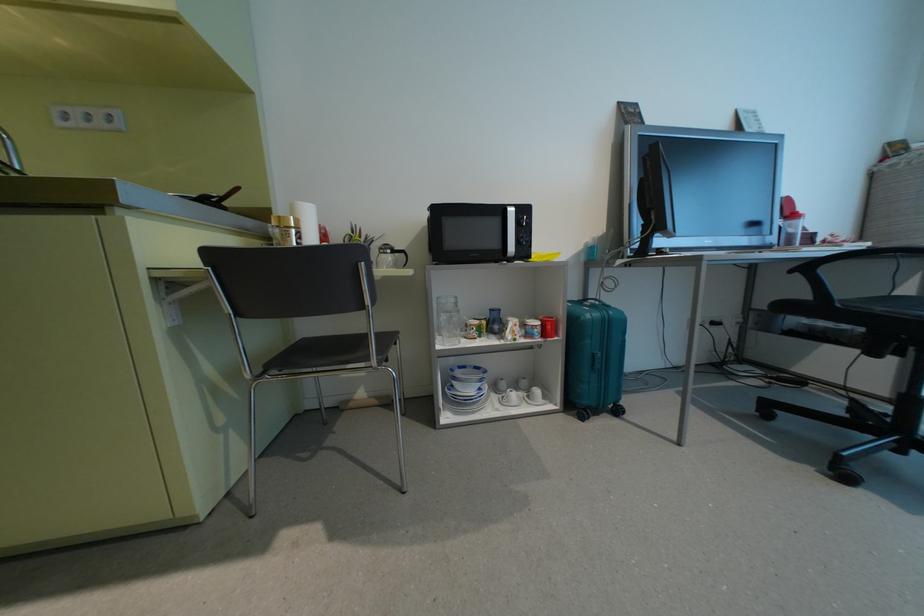
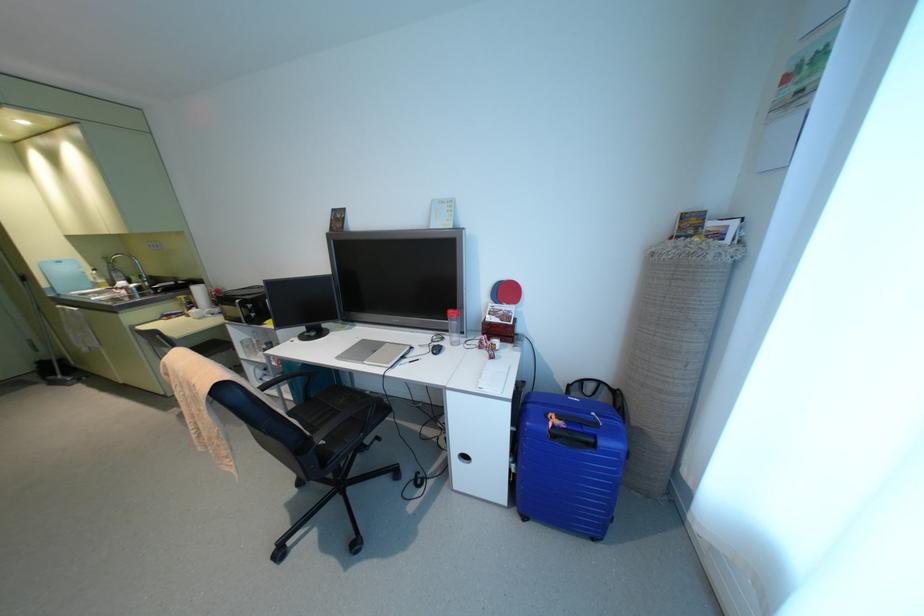
Question: The images are taken continuously from a first-person perspective. In which direction are you moving?

Choices:
 (A) Left
 (B) Right
 (C) Forward
 (D) Backward

Answer: (B)